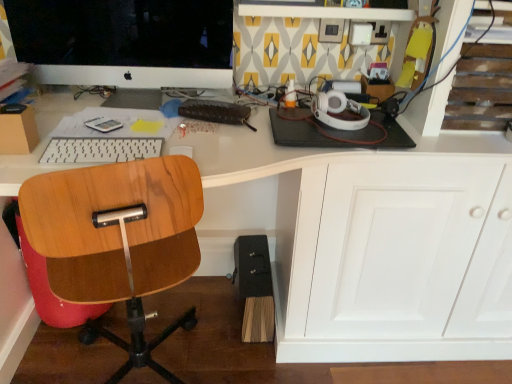
Question: From the image's perspective, is white plastic keyboard at center located beneath matte black monitor at upper left?

Choices:
 (A) yes
 (B) no

Answer: (A)

Question: Is white plastic keyboard at center taller than matte black monitor at upper left?

Choices:
 (A) yes
 (B) no

Answer: (B)

Question: Is white plastic keyboard at center positioned before matte black monitor at upper left?

Choices:
 (A) no
 (B) yes

Answer: (B)

Question: From a real-world perspective, is white plastic keyboard at center over matte black monitor at upper left?

Choices:
 (A) yes
 (B) no

Answer: (B)

Question: Is white plastic keyboard at center positioned behind matte black monitor at upper left?

Choices:
 (A) no
 (B) yes

Answer: (A)

Question: From the image's perspective, is white plastic keyboard at center on top of matte black monitor at upper left?

Choices:
 (A) yes
 (B) no

Answer: (B)

Question: Is white plastic keyboard at center positioned beyond the bounds of white glossy desk at center?

Choices:
 (A) yes
 (B) no

Answer: (B)

Question: Can you confirm if white plastic keyboard at center is thinner than white glossy desk at center?

Choices:
 (A) yes
 (B) no

Answer: (A)

Question: Is white plastic keyboard at center to the left of white glossy desk at center from the viewer's perspective?

Choices:
 (A) yes
 (B) no

Answer: (A)

Question: Is white plastic keyboard at center not near white glossy desk at center?

Choices:
 (A) no
 (B) yes

Answer: (A)

Question: Does white plastic keyboard at center have a lesser height compared to white glossy desk at center?

Choices:
 (A) yes
 (B) no

Answer: (A)

Question: Is white plastic keyboard at center closer to camera compared to white glossy desk at center?

Choices:
 (A) yes
 (B) no

Answer: (B)

Question: From the image's perspective, would you say white glossy desk at center is positioned over wooden chair at left?

Choices:
 (A) yes
 (B) no

Answer: (A)